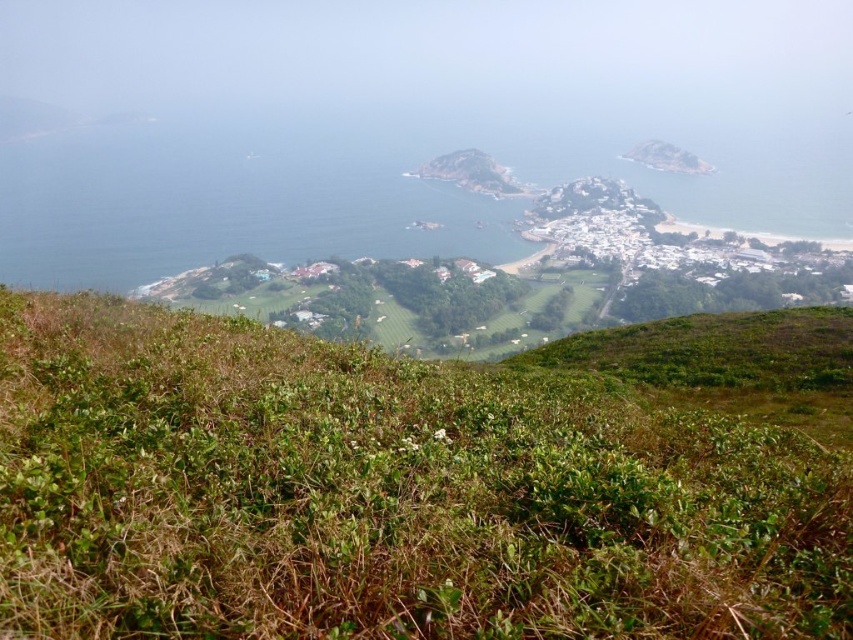
Who is lower down, green leafy shrubs at center or blue water at center?

green leafy shrubs at center

Who is more distant from viewer, (291, 614) or (242, 150)?

The point (242, 150) is more distant.

Does point (120, 628) come closer to viewer compared to point (492, 208)?

Yes, point (120, 628) is closer to viewer.

The image size is (853, 640). What are the coordinates of `green leafy shrubs at center` in the screenshot? It's located at (383, 493).

Can you confirm if blue water at center is taller than rugged brown rock at center?

Indeed, blue water at center has a greater height compared to rugged brown rock at center.

Which of these two, blue water at center or rugged brown rock at center, stands shorter?

With less height is rugged brown rock at center.

Is point (430, 195) behind point (473, 163)?

No, it is in front of (473, 163).

This screenshot has height=640, width=853. Find the location of `blue water at center`. blue water at center is located at coordinates (230, 200).

Does green leafy shrubs at center have a greater width compared to rugged brown rock at center?

No, green leafy shrubs at center is not wider than rugged brown rock at center.

Is point (448, 426) farther from camera compared to point (480, 184)?

No, (448, 426) is in front of (480, 184).

Is point (686, 456) farther from viewer compared to point (456, 168)?

That is False.

Where is `green leafy shrubs at center`? The image size is (853, 640). green leafy shrubs at center is located at coordinates (383, 493).